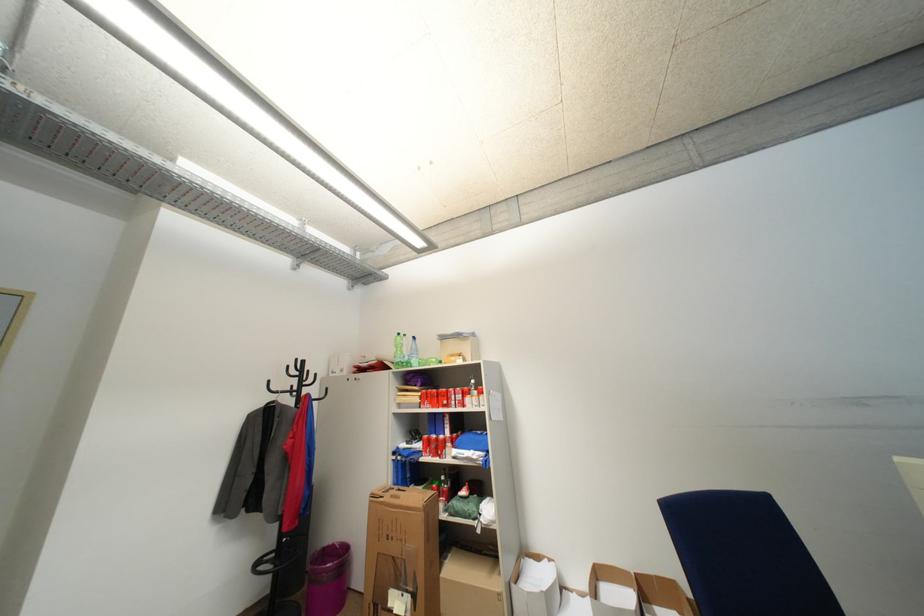
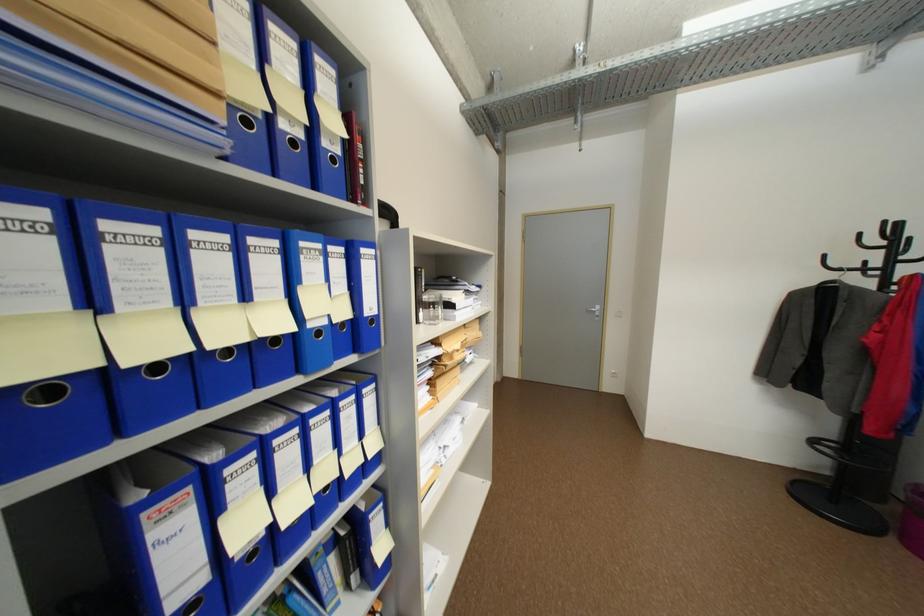
The point at (305, 361) is marked in the first image. Where is the corresponding point in the second image?

(893, 224)